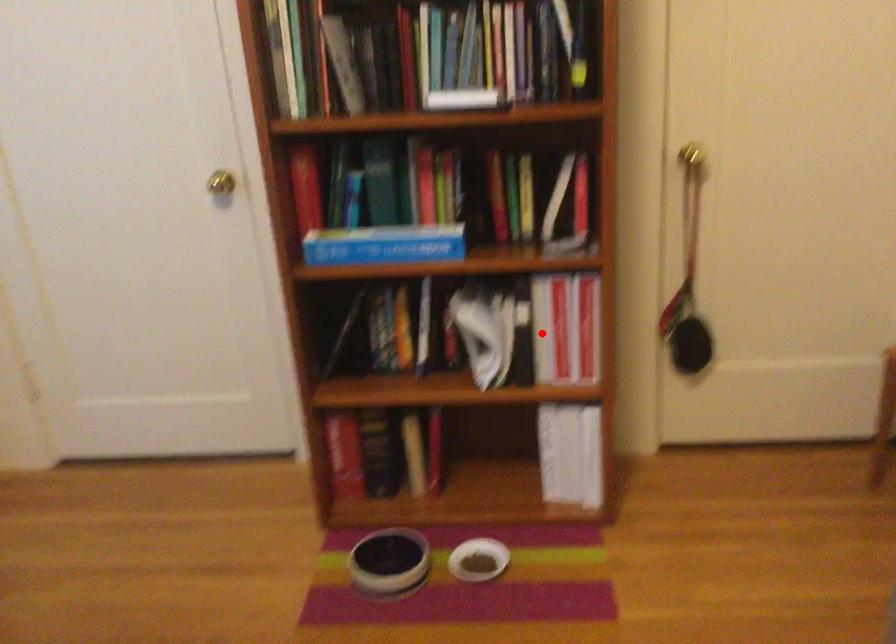
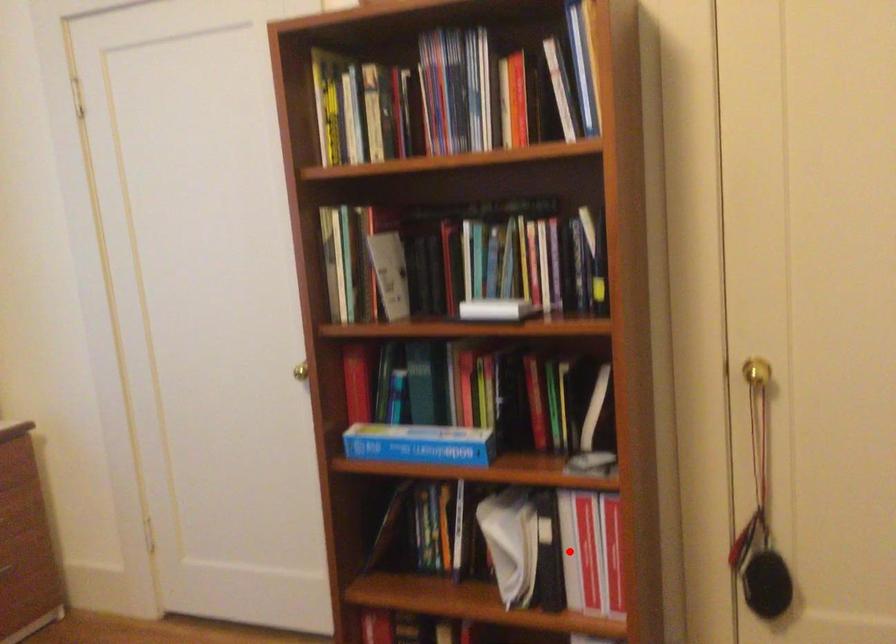
I am providing you with two images of the same scene from different viewpoints. A red point is marked on the first image and another point is marked on the second image. Are the points marked in image1 and image2 representing the same 3D position?

Yes